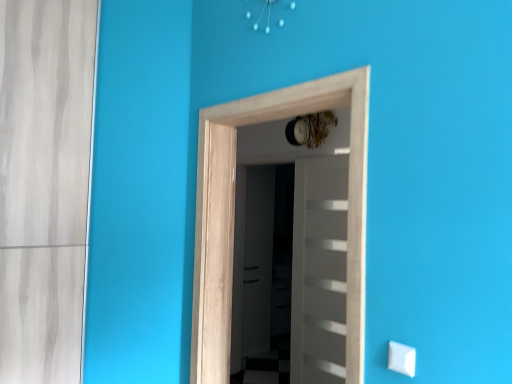
The width and height of the screenshot is (512, 384). Describe the element at coordinates (402, 358) in the screenshot. I see `white plastic light switch at lower right` at that location.

What do you see at coordinates (263, 275) in the screenshot?
I see `transparent glass screen door at center` at bounding box center [263, 275].

The image size is (512, 384). Identify the location of white plastic light switch at lower right. (402, 358).

Considering the positions of objects white plastic light switch at lower right and transparent glass screen door at center in the image provided, who is more to the left, white plastic light switch at lower right or transparent glass screen door at center?

transparent glass screen door at center.

In the scene shown: Is white plastic light switch at lower right completely or partially outside of transparent glass screen door at center?

That's correct, white plastic light switch at lower right is outside of transparent glass screen door at center.

From a real-world perspective, who is located higher, white plastic light switch at lower right or transparent glass screen door at center?

From a 3D spatial view, white plastic light switch at lower right is above.

Considering the positions of objects white plastic light switch at lower right and transparent glass screen door at center in the image provided, who is in front, white plastic light switch at lower right or transparent glass screen door at center?

white plastic light switch at lower right is closer to the camera.

From the image's perspective, relative to white glossy door at center, positioned as the first door in back-to-front order, is natural wood door at center, the 2th door when ordered from back to front, above or below?

From the image's perspective, natural wood door at center, the 2th door when ordered from back to front, appears above white glossy door at center, positioned as the first door in back-to-front order.

Could you measure the distance between natural wood door at center, the 2th door when ordered from back to front, and white glossy door at center, acting as the second door starting from the front?

1.29 meters.

Is natural wood door at center, which ranks as the first door in front-to-back order, in contact with white glossy door at center, positioned as the first door in back-to-front order?

natural wood door at center, which ranks as the first door in front-to-back order, and white glossy door at center, positioned as the first door in back-to-front order, are clearly separated.

Does natural wood door at center, the 2th door when ordered from back to front, turn towards white glossy door at center, positioned as the first door in back-to-front order?

No, natural wood door at center, the 2th door when ordered from back to front, is not oriented towards white glossy door at center, positioned as the first door in back-to-front order.

Based on the photo, does transparent glass screen door at center have a lesser width compared to white plastic light switch at lower right?

No.

From a real-world perspective, is transparent glass screen door at center under white plastic light switch at lower right?

Yes, from a real-world perspective, transparent glass screen door at center is below white plastic light switch at lower right.

How different are the orientations of white glossy door at center, acting as the second door starting from the front, and white plastic light switch at lower right in degrees?

There is a 1.13-degree angle between the facing directions of white glossy door at center, acting as the second door starting from the front, and white plastic light switch at lower right.

Which is in front, point (294, 332) or point (396, 369)?

Point (396, 369)

Would you say white glossy door at center, acting as the second door starting from the front, is to the left or to the right of white plastic light switch at lower right in the picture?

From the image, it's evident that white glossy door at center, acting as the second door starting from the front, is to the right of white plastic light switch at lower right.

Based on the photo, considering the sizes of white glossy door at center, acting as the second door starting from the front, and white plastic light switch at lower right in the image, is white glossy door at center, acting as the second door starting from the front, taller or shorter than white plastic light switch at lower right?

Clearly, white glossy door at center, acting as the second door starting from the front, is taller compared to white plastic light switch at lower right.

Is white glossy door at center, positioned as the first door in back-to-front order, far away from transparent glass screen door at center?

Indeed, white glossy door at center, positioned as the first door in back-to-front order, is not near transparent glass screen door at center.

Can you confirm if white glossy door at center, acting as the second door starting from the front, is thinner than transparent glass screen door at center?

Yes.

From the image's perspective, is white glossy door at center, positioned as the first door in back-to-front order, above or below transparent glass screen door at center?

Based on their image positions, white glossy door at center, positioned as the first door in back-to-front order, is located above transparent glass screen door at center.

How many degrees apart are the facing directions of white glossy door at center, positioned as the first door in back-to-front order, and transparent glass screen door at center?

0.0034 degrees.

Is transparent glass screen door at center facing towards natural wood door at center, the 2th door when ordered from back to front?

No, transparent glass screen door at center does not turn towards natural wood door at center, the 2th door when ordered from back to front.

Which point is more distant from viewer, (246, 259) or (210, 285)?

The point (246, 259) is farther from the camera.

From a real-world perspective, is natural wood door at center, the 2th door when ordered from back to front, positioned above or below transparent glass screen door at center?

From a real-world perspective, natural wood door at center, the 2th door when ordered from back to front, is physically above transparent glass screen door at center.

Does natural wood door at center, which ranks as the first door in front-to-back order, have a larger size compared to transparent glass screen door at center?

No, natural wood door at center, which ranks as the first door in front-to-back order, is not bigger than transparent glass screen door at center.

Which object is positioned more to the left, natural wood door at center, which ranks as the first door in front-to-back order, or transparent glass screen door at center?

From the viewer's perspective, transparent glass screen door at center appears more on the left side.

Locate an element on the screen. The height and width of the screenshot is (384, 512). screen door on the left of white plastic light switch at lower right is located at coordinates (263, 275).

Identify the location of door above the white glossy door at center, positioned as the first door in back-to-front order (from a real-world perspective). (233, 214).

From the image, which object appears to be nearer to white glossy door at center, positioned as the first door in back-to-front order, white plastic light switch at lower right or transparent glass screen door at center?

transparent glass screen door at center lies closer to white glossy door at center, positioned as the first door in back-to-front order, than the other object.

From the image, which object appears to be nearer to natural wood door at center, which ranks as the first door in front-to-back order, white plastic light switch at lower right or transparent glass screen door at center?

Based on the image, white plastic light switch at lower right appears to be nearer to natural wood door at center, which ranks as the first door in front-to-back order.

From the picture: Which object lies further to the anchor point natural wood door at center, which ranks as the first door in front-to-back order, white glossy door at center, positioned as the first door in back-to-front order, or white plastic light switch at lower right?

Based on the image, white glossy door at center, positioned as the first door in back-to-front order, appears to be further to natural wood door at center, which ranks as the first door in front-to-back order.

When comparing their distances from natural wood door at center, the 2th door when ordered from back to front, does transparent glass screen door at center or white plastic light switch at lower right seem closer?

Based on the image, white plastic light switch at lower right appears to be nearer to natural wood door at center, the 2th door when ordered from back to front.

Based on the photo, from the image, which object appears to be nearer to natural wood door at center, the 2th door when ordered from back to front, transparent glass screen door at center or white glossy door at center, positioned as the first door in back-to-front order?

Among the two, white glossy door at center, positioned as the first door in back-to-front order, is located nearer to natural wood door at center, the 2th door when ordered from back to front.

When comparing their distances from transparent glass screen door at center, does white plastic light switch at lower right or white glossy door at center, acting as the second door starting from the front, seem closer?

Among the two, white glossy door at center, acting as the second door starting from the front, is located nearer to transparent glass screen door at center.

Considering their positions, is natural wood door at center, the 2th door when ordered from back to front, positioned closer to white glossy door at center, acting as the second door starting from the front, than transparent glass screen door at center?

The object closer to white glossy door at center, acting as the second door starting from the front, is transparent glass screen door at center.

Estimate the real-world distances between objects in this image. Which object is closer to transparent glass screen door at center, white glossy door at center, acting as the second door starting from the front, or natural wood door at center, which ranks as the first door in front-to-back order?

Among the two, white glossy door at center, acting as the second door starting from the front, is located nearer to transparent glass screen door at center.

The height and width of the screenshot is (384, 512). I want to click on door between white plastic light switch at lower right and white glossy door at center, acting as the second door starting from the front, from front to back, so (x=233, y=214).

The height and width of the screenshot is (384, 512). In order to click on door between natural wood door at center, which ranks as the first door in front-to-back order, and transparent glass screen door at center, along the z-axis in this screenshot , I will do `click(319, 270)`.